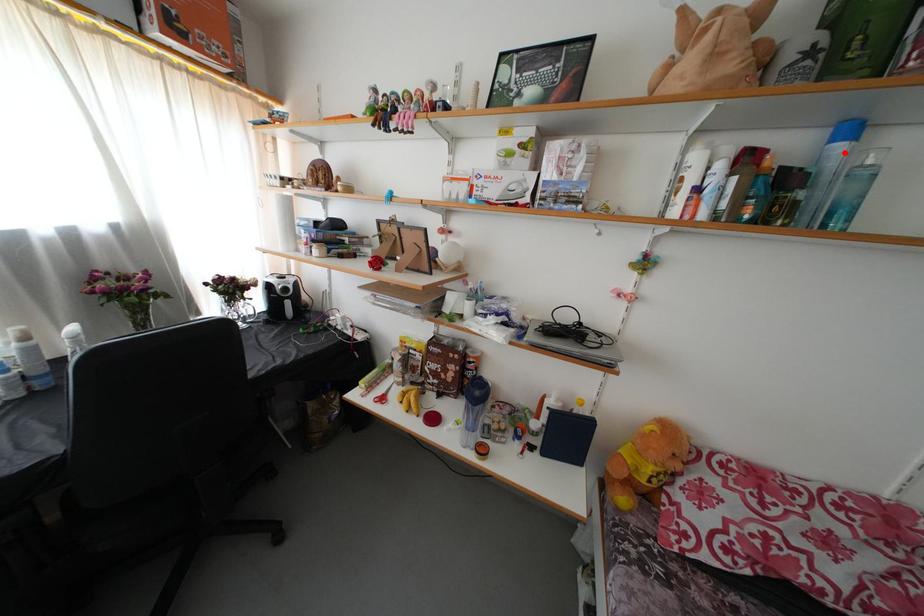
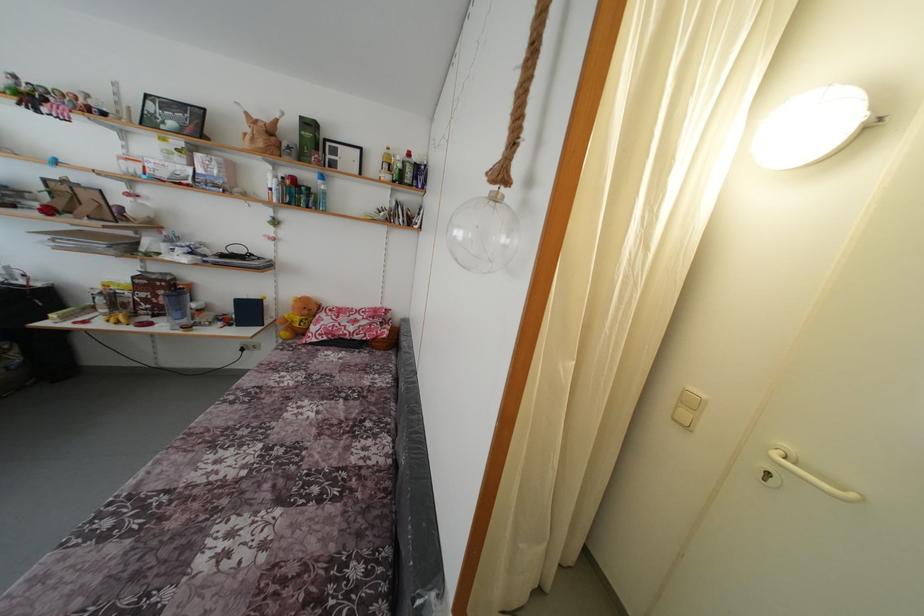
Question: I am providing you with two images of the same scene from different viewpoints. A red point is shown in image1. For the corresponding object point in image2, is it positioned nearer or farther from the camera?

Choices:
 (A) Nearer
 (B) Farther

Answer: (A)